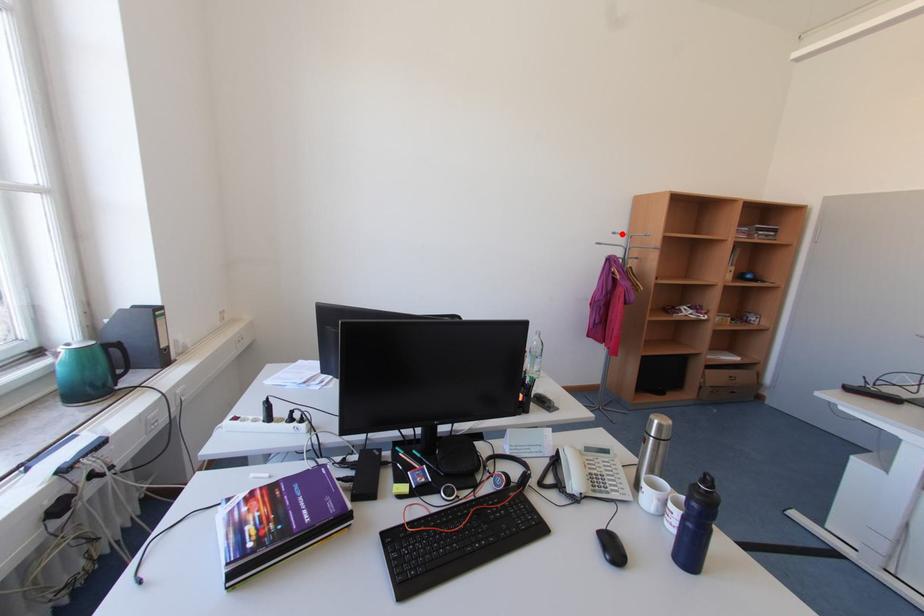
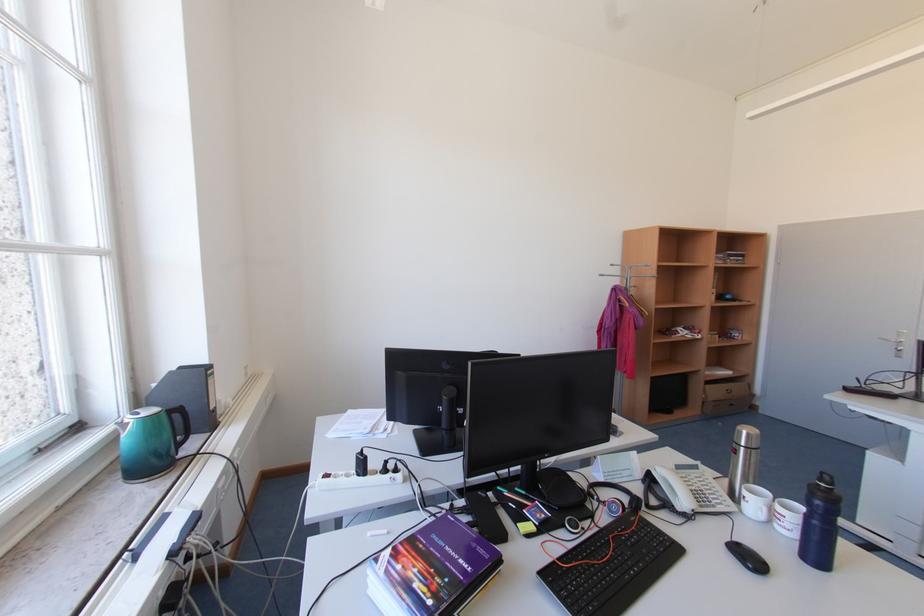
The point at the highlighted location is marked in the first image. Where is the corresponding point in the second image?

(619, 265)